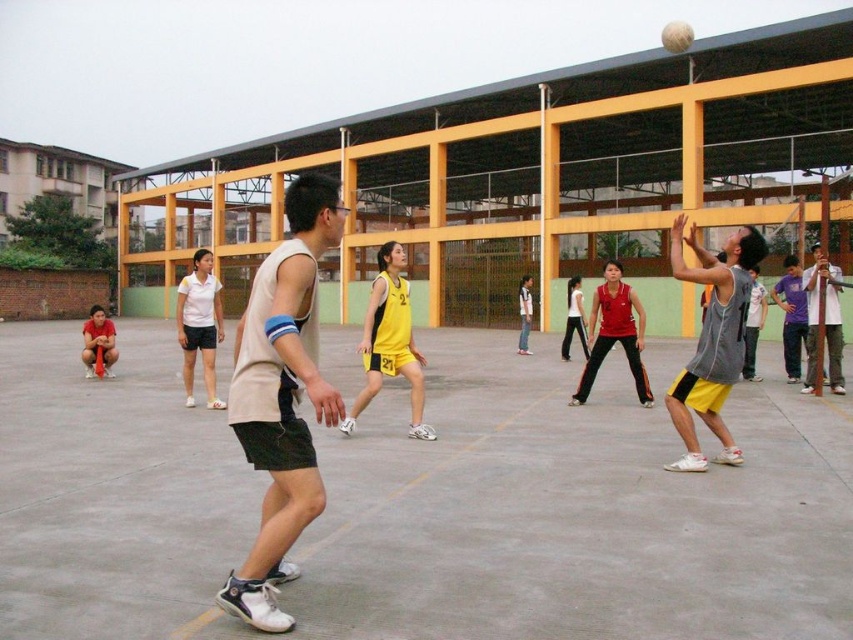
You are a photographer standing at the point with coordinates (282, 397). What object is located at your current position?

The light beige sleeveless shirt at center is located at the point with coordinates (282, 397).